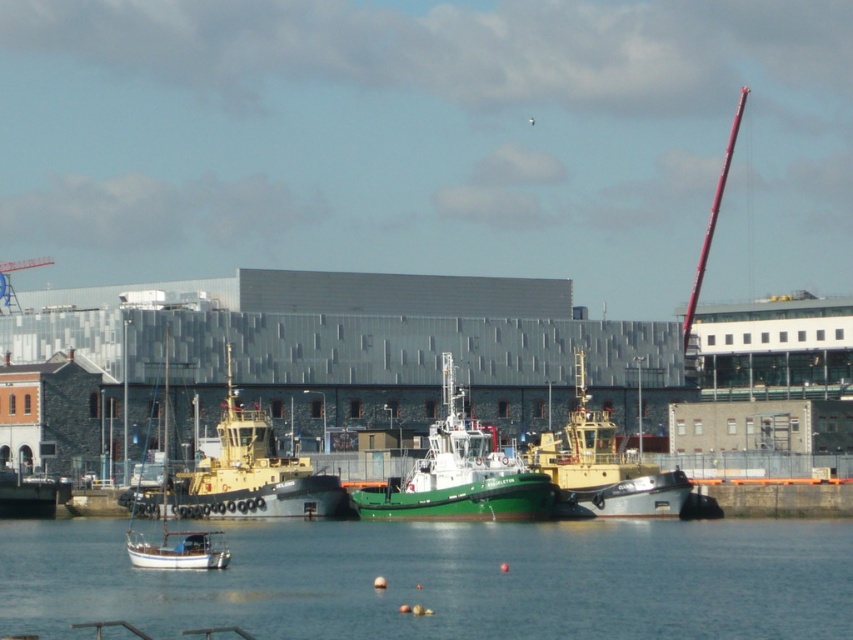
Question: Which object is closer to the camera taking this photo?

Choices:
 (A) transparent water at lower center
 (B) metallic yellow tugboat at center
 (C) green matte tugboat at center
 (D) yellow matte tugboat at center

Answer: (A)

Question: Which object is farther from the camera taking this photo?

Choices:
 (A) green matte tugboat at center
 (B) yellow matte tugboat at center
 (C) metallic yellow tugboat at center
 (D) white matte sailboat at center

Answer: (C)

Question: Where is transparent water at lower center located in relation to green matte tugboat at center in the image?

Choices:
 (A) above
 (B) below

Answer: (B)

Question: Can you confirm if green matte tugboat at center is positioned to the left of metallic yellow tugboat at center?

Choices:
 (A) yes
 (B) no

Answer: (B)

Question: Does transparent water at lower center have a greater width compared to smooth red pole at upper right?

Choices:
 (A) no
 (B) yes

Answer: (B)

Question: Which point is closer to the camera?

Choices:
 (A) transparent water at lower center
 (B) green matte tugboat at center
 (C) metallic yellow tugboat at center
 (D) white matte sailboat at center

Answer: (A)